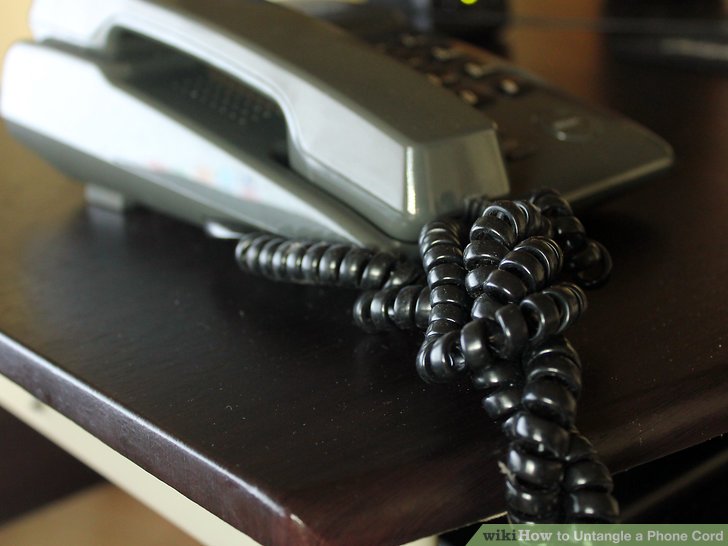
The width and height of the screenshot is (728, 546). I want to click on floor, so click(111, 511).